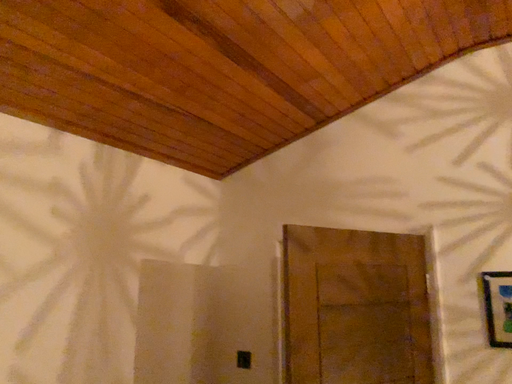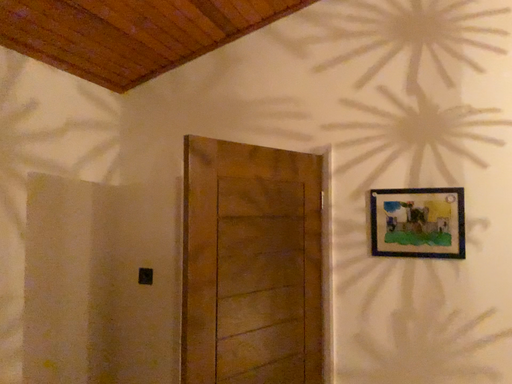
Question: How did the camera likely rotate when shooting the video?

Choices:
 (A) rotated upward
 (B) rotated downward

Answer: (B)